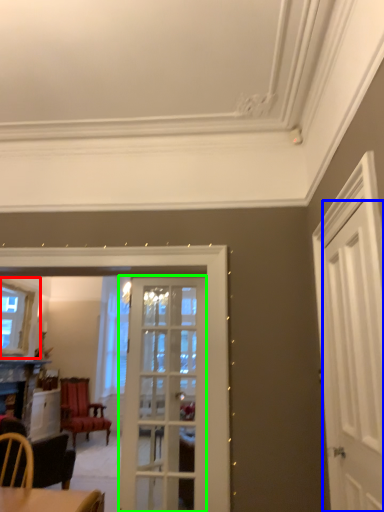
Question: Which object is the farthest from window (highlighted by a red box)? Choose among these: door (highlighted by a blue box) or door (highlighted by a green box).

Choices:
 (A) door
 (B) door

Answer: (A)